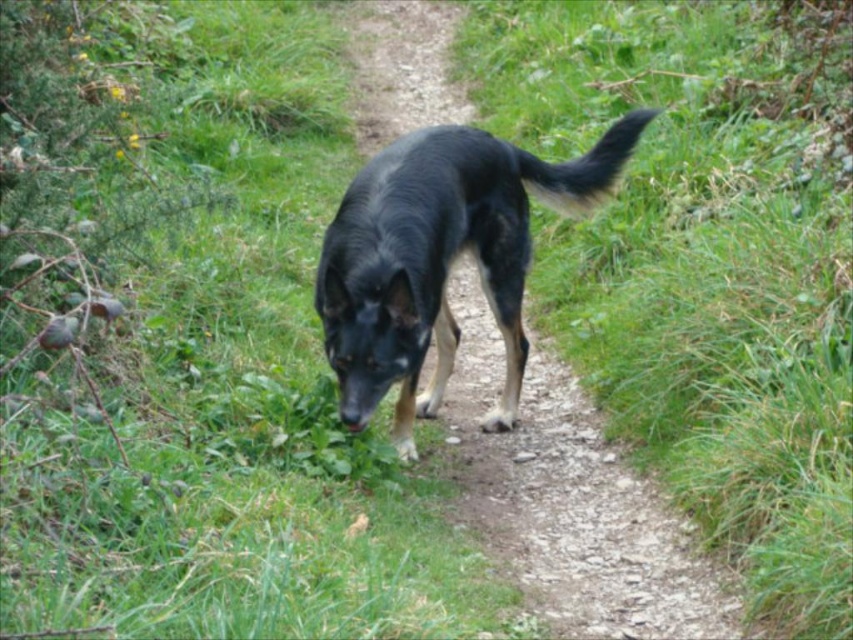
Question: Among these objects, which one is nearest to the camera?

Choices:
 (A) green grassy at center
 (B) shiny black fur at center

Answer: (A)

Question: From the image, what is the correct spatial relationship of green grassy at center in relation to shiny black fur at center?

Choices:
 (A) above
 (B) below

Answer: (A)

Question: Is green grassy at center to the left of shiny black fur at center from the viewer's perspective?

Choices:
 (A) yes
 (B) no

Answer: (B)

Question: Among these objects, which one is nearest to the camera?

Choices:
 (A) green grassy at center
 (B) shiny black fur at center

Answer: (A)

Question: Considering the relative positions of green grassy at center and shiny black fur at center in the image provided, where is green grassy at center located with respect to shiny black fur at center?

Choices:
 (A) left
 (B) right

Answer: (B)

Question: Which object appears farthest from the camera in this image?

Choices:
 (A) green grassy at center
 (B) shiny black fur at center

Answer: (B)